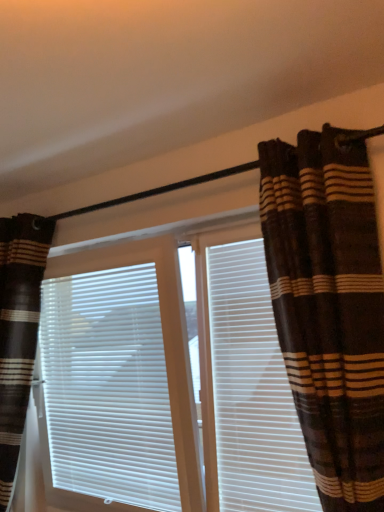
Measure the distance between brown striped curtains at center and camera.

brown striped curtains at center and camera are 1.44 meters apart.

At what (x,y) coordinates should I click in order to perform the action: click on brown striped curtain at right, the 1th curtain viewed from the right. Please return your answer as a coordinate pair (x, y). The height and width of the screenshot is (512, 384). Looking at the image, I should click on (329, 305).

How much space does brown striped curtain at left, arranged as the 2th curtain when viewed from the front, occupy vertically?

It is 1.42 meters.

Find the location of a particular element. The height and width of the screenshot is (512, 384). white matte window blind at center is located at coordinates (109, 386).

You are a GUI agent. You are given a task and a screenshot of the screen. Output one action in this format:
    pyautogui.click(x=<x>, y=<y>)
    Task: Click on the brown striped curtains at center
    The height and width of the screenshot is (512, 384).
    Given the screenshot: What is the action you would take?
    pyautogui.click(x=176, y=328)

Between brown striped curtain at right, the 1th curtain positioned from the front, and brown striped curtain at left, arranged as the 2th curtain when viewed from the front, which one has more height?

brown striped curtain at left, arranged as the 2th curtain when viewed from the front, is taller.

Is brown striped curtain at right, the 1th curtain viewed from the right, directly adjacent to brown striped curtain at left, marked as the second curtain in a right-to-left arrangement?

brown striped curtain at right, the 1th curtain viewed from the right, and brown striped curtain at left, marked as the second curtain in a right-to-left arrangement, are not in contact.

Can you tell me how much brown striped curtain at right, the 1th curtain viewed from the right, and brown striped curtain at left, which ranks as the 1th curtain in back-to-front order, differ in facing direction?

0.34 degrees.

Does brown striped curtain at right, placed as the 2th curtain when sorted from back to front, appear on the left side of brown striped curtain at left, marked as the second curtain in a right-to-left arrangement?

In fact, brown striped curtain at right, placed as the 2th curtain when sorted from back to front, is to the right of brown striped curtain at left, marked as the second curtain in a right-to-left arrangement.

From a real-world perspective, which is physically above, white matte window blind at center or white plastic shutter at center?

white plastic shutter at center.

Is white matte window blind at center beside white plastic shutter at center?

white matte window blind at center is not next to white plastic shutter at center, and they're not touching.

Which is more to the left, white matte window blind at center or white plastic shutter at center?

Positioned to the left is white matte window blind at center.

How different are the orientations of white matte window blind at center and white plastic shutter at center in degrees?

2.44 degrees separate the facing orientations of white matte window blind at center and white plastic shutter at center.

Which is more to the right, brown striped curtain at right, which is the second curtain from left to right, or brown striped curtains at center?

From the viewer's perspective, brown striped curtain at right, which is the second curtain from left to right, appears more on the right side.

Is brown striped curtain at right, the 1th curtain viewed from the right, positioned with its back to brown striped curtains at center?

No.

Can you confirm if brown striped curtain at right, placed as the 2th curtain when sorted from back to front, is shorter than brown striped curtains at center?

Correct, brown striped curtain at right, placed as the 2th curtain when sorted from back to front, is not as tall as brown striped curtains at center.

Does point (310, 315) appear closer or farther from the camera than point (205, 335)?

Point (310, 315) appears to be closer to the viewer than point (205, 335).

Which of these two, brown striped curtains at center or brown striped curtain at left, marked as the second curtain in a right-to-left arrangement, is thinner?

brown striped curtains at center.

Are brown striped curtains at center and brown striped curtain at left, arranged as the 2th curtain when viewed from the front, making contact?

No.

Considering the relative positions of brown striped curtains at center and brown striped curtain at left, arranged as the 2th curtain when viewed from the front, in the image provided, is brown striped curtains at center to the right of brown striped curtain at left, arranged as the 2th curtain when viewed from the front, from the viewer's perspective?

Yes, brown striped curtains at center is to the right of brown striped curtain at left, arranged as the 2th curtain when viewed from the front.

Is the depth of brown striped curtains at center greater than that of brown striped curtain at left, marked as the second curtain in a right-to-left arrangement?

No.

In the scene shown: Is brown striped curtain at right, the 1th curtain viewed from the right, not inside white plastic shutter at center?

Yes.

Which is closer, (349, 325) or (260, 278)?

Point (349, 325).

In order to click on curtain lying on the right of white plastic shutter at center in this screenshot , I will do `click(329, 305)`.

Is brown striped curtain at right, placed as the 2th curtain when sorted from back to front, aimed at white plastic shutter at center?

No, brown striped curtain at right, placed as the 2th curtain when sorted from back to front, is not facing towards white plastic shutter at center.

Considering the sizes of objects brown striped curtains at center and white plastic shutter at center in the image provided, who is taller, brown striped curtains at center or white plastic shutter at center?

With more height is brown striped curtains at center.

How far apart are brown striped curtains at center and white plastic shutter at center?

A distance of 2.64 inches exists between brown striped curtains at center and white plastic shutter at center.

Which of these two, brown striped curtains at center or white plastic shutter at center, is thinner?

white plastic shutter at center is thinner.

I want to click on shutter located on the right of brown striped curtains at center, so click(252, 390).

Considering the sizes of objects brown striped curtain at left, which is counted as the first curtain, starting from the left, and brown striped curtain at right, placed as the 2th curtain when sorted from back to front, in the image provided, who is smaller, brown striped curtain at left, which is counted as the first curtain, starting from the left, or brown striped curtain at right, placed as the 2th curtain when sorted from back to front,?

Smaller between the two is brown striped curtain at right, placed as the 2th curtain when sorted from back to front.

At what (x,y) coordinates should I click in order to perform the action: click on curtain in front of the brown striped curtain at left, which ranks as the 1th curtain in back-to-front order. Please return your answer as a coordinate pair (x, y). The width and height of the screenshot is (384, 512). Looking at the image, I should click on (329, 305).

Which is nearer, (10, 279) or (348, 470)?

Clearly, point (10, 279) is more distant from the camera than point (348, 470).

Is brown striped curtain at left, marked as the second curtain in a right-to-left arrangement, not close to brown striped curtain at right, the 1th curtain positioned from the front?

Yes, brown striped curtain at left, marked as the second curtain in a right-to-left arrangement, and brown striped curtain at right, the 1th curtain positioned from the front, are quite far apart.

Find the location of a particular element. The image size is (384, 512). curtain located underneath the brown striped curtain at right, the 1th curtain positioned from the front (from a real-world perspective) is located at coordinates (18, 330).

Locate an element on the screen. The height and width of the screenshot is (512, 384). shutter in front of the white matte window blind at center is located at coordinates (252, 390).

Looking at the image, which one is located closer to brown striped curtain at right, which is the second curtain from left to right, brown striped curtain at left, which ranks as the 1th curtain in back-to-front order, or white plastic shutter at center?

Among the two, white plastic shutter at center is located nearer to brown striped curtain at right, which is the second curtain from left to right.

Estimate the real-world distances between objects in this image. Which object is closer to brown striped curtain at left, which is counted as the first curtain, starting from the left, brown striped curtain at right, the 1th curtain positioned from the front, or white matte window blind at center?

Based on the image, white matte window blind at center appears to be nearer to brown striped curtain at left, which is counted as the first curtain, starting from the left.

Based on their spatial positions, is brown striped curtain at left, arranged as the 2th curtain when viewed from the front, or white plastic shutter at center further from brown striped curtains at center?

brown striped curtain at left, arranged as the 2th curtain when viewed from the front.

Which object lies further to the anchor point brown striped curtains at center, white plastic shutter at center or brown striped curtain at left, marked as the second curtain in a right-to-left arrangement?

Among the two, brown striped curtain at left, marked as the second curtain in a right-to-left arrangement, is located further to brown striped curtains at center.

Based on the photo, which object lies nearer to the anchor point brown striped curtain at left, which ranks as the 1th curtain in back-to-front order, white plastic shutter at center or brown striped curtains at center?

The object closer to brown striped curtain at left, which ranks as the 1th curtain in back-to-front order, is brown striped curtains at center.

When comparing their distances from white matte window blind at center, does brown striped curtain at right, the 1th curtain viewed from the right, or brown striped curtain at left, marked as the second curtain in a right-to-left arrangement, seem closer?

Among the two, brown striped curtain at left, marked as the second curtain in a right-to-left arrangement, is located nearer to white matte window blind at center.

When comparing their distances from brown striped curtain at right, which is the second curtain from left to right, does white plastic shutter at center or brown striped curtains at center seem further?

Based on the image, brown striped curtains at center appears to be further to brown striped curtain at right, which is the second curtain from left to right.

Looking at the image, which one is located closer to white plastic shutter at center, brown striped curtains at center or brown striped curtain at left, which ranks as the 1th curtain in back-to-front order?

brown striped curtains at center is closer to white plastic shutter at center.

You are a GUI agent. You are given a task and a screenshot of the screen. Output one action in this format:
    pyautogui.click(x=<x>, y=<y>)
    Task: Click on the bay window between brown striped curtain at left, which is counted as the first curtain, starting from the left, and white plastic shutter at center, in the horizontal direction
    
    Given the screenshot: What is the action you would take?
    pyautogui.click(x=176, y=328)

Identify the location of bay window located between white matte window blind at center and brown striped curtain at right, which is the second curtain from left to right, in the left-right direction. (176, 328).

You are a GUI agent. You are given a task and a screenshot of the screen. Output one action in this format:
    pyautogui.click(x=<x>, y=<y>)
    Task: Click on the window blind situated between brown striped curtain at left, marked as the second curtain in a right-to-left arrangement, and brown striped curtain at right, placed as the 2th curtain when sorted from back to front, from left to right
    
    Given the screenshot: What is the action you would take?
    pyautogui.click(x=109, y=386)

This screenshot has width=384, height=512. Find the location of `bay window between white matte window blind at center and white plastic shutter at center`. bay window between white matte window blind at center and white plastic shutter at center is located at coordinates (176, 328).